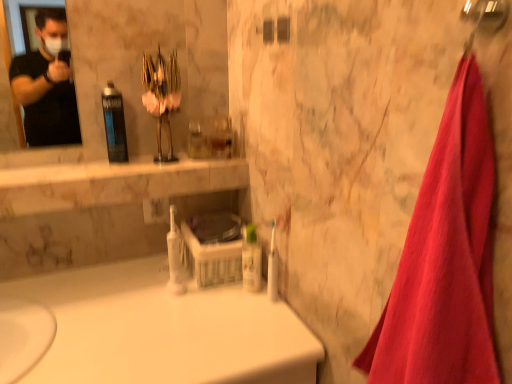
The height and width of the screenshot is (384, 512). In order to click on vacant area that is in front of white plastic toothbrush at center, the second mouthwash positioned from the left in this screenshot , I will do `click(175, 333)`.